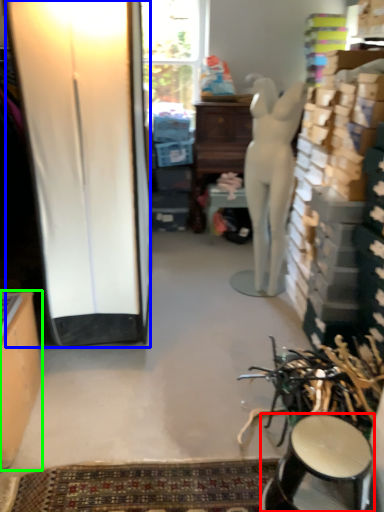
Question: Estimate the real-world distances between objects in this image. Which object is farther from stool (highlighted by a red box), screen door (highlighted by a blue box) or cabinetry (highlighted by a green box)?

Choices:
 (A) screen door
 (B) cabinetry

Answer: (A)